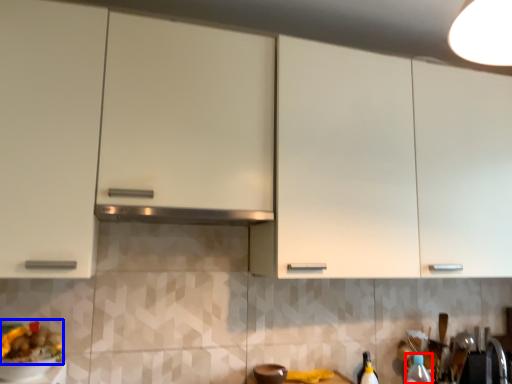
Question: Which of the following is the closest to the observer, bottle (highlighted by a red box) or food (highlighted by a blue box)?

Choices:
 (A) bottle
 (B) food

Answer: (B)